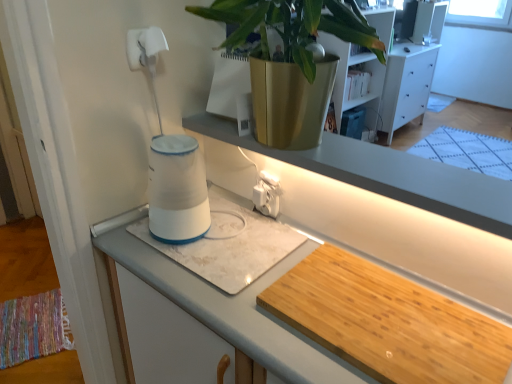
The height and width of the screenshot is (384, 512). What are the coordinates of `vacant area that lies between white glossy cup at center, which is counted as the 1th wide, starting from the left, and wooden cutting board at lower right, which is the 2th wide from left to right` in the screenshot? It's located at (278, 280).